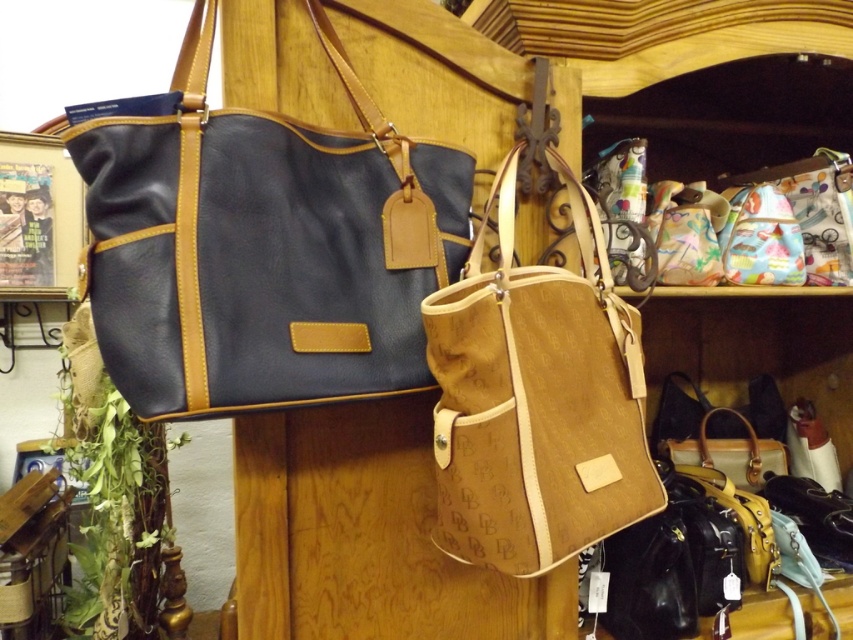
Question: Which object is closer to the camera taking this photo?

Choices:
 (A) brown canvas tote at center
 (B) matte black leather shoulder bag at left

Answer: (B)

Question: Can you confirm if matte black leather shoulder bag at left is positioned to the left of brown canvas tote at center?

Choices:
 (A) yes
 (B) no

Answer: (A)

Question: Where is matte black leather shoulder bag at left located in relation to brown canvas tote at center in the image?

Choices:
 (A) above
 (B) below

Answer: (A)

Question: Is matte black leather shoulder bag at left thinner than brown canvas tote at center?

Choices:
 (A) no
 (B) yes

Answer: (A)

Question: Which point appears farthest from the camera in this image?

Choices:
 (A) (552, 301)
 (B) (131, 214)

Answer: (A)

Question: Among these points, which one is nearest to the camera?

Choices:
 (A) pyautogui.click(x=351, y=227)
 (B) pyautogui.click(x=529, y=506)

Answer: (B)